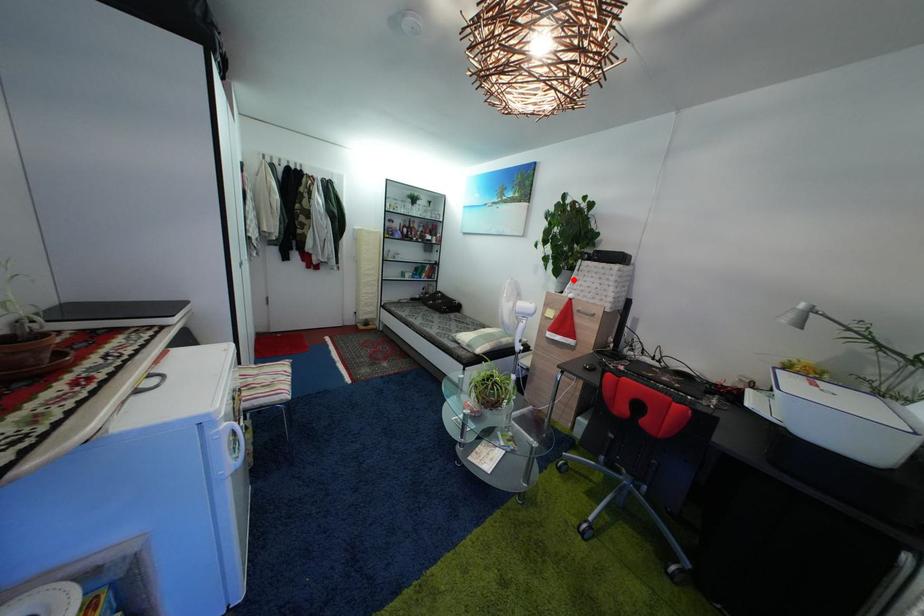
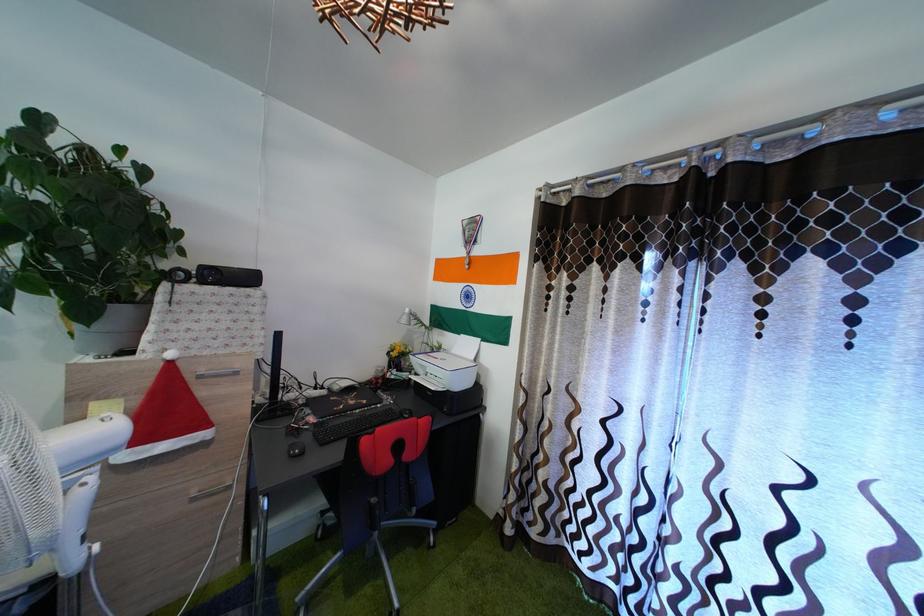
Find the pixel in the second image that matches the highlighted location in the first image.

(128, 318)